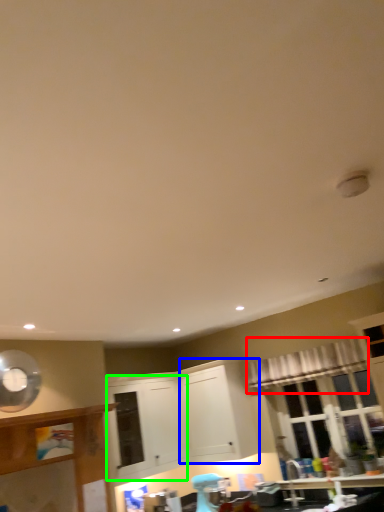
Question: Which object is the farthest from curtain (highlighted by a red box)? Choose among these: cabinetry (highlighted by a blue box) or cabinetry (highlighted by a green box).

Choices:
 (A) cabinetry
 (B) cabinetry

Answer: (B)